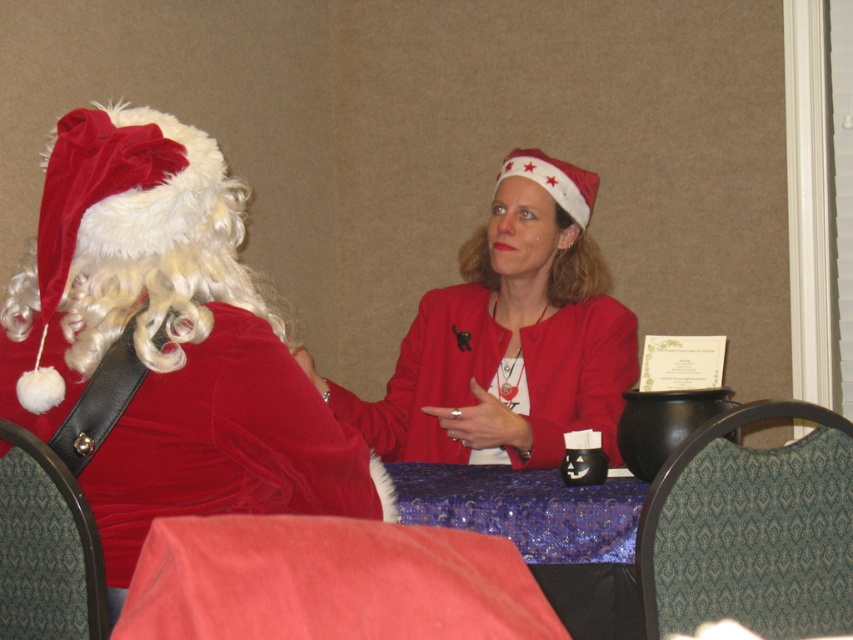
Consider the image. You are a delivery person with a box that is 1.2 meters long. You need to place it between the velvet santa claus at left and the velvet red chair at lower left. Is there enough space?

The distance between the velvet santa claus at left and the velvet red chair at lower left is 1.00 meters. Since the box is 1.2 meters long, it will not fit in the available space.

You are planning to place a small gift box between the velvet santa claus at left and the green fabric chair at lower left. Based on their positions, which object should the gift box be closer to?

The velvet santa claus at left is to the right of green fabric chair at lower left, so the gift box should be placed closer to the green fabric chair at lower left to be between them.

You are standing at the center of the room and want to sit on the velvet red chair at lower left. Which direction should you move to reach it?

The velvet red chair at lower left is located at point (328, 580), so you should move towards the lower left direction to reach it.